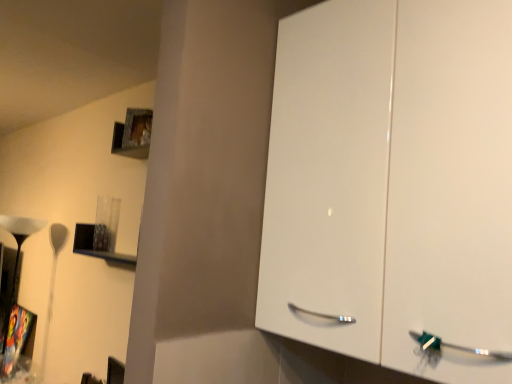
Question: Considering the positions of matte black lampshade at left and metallic silver shelf at upper left in the image, is matte black lampshade at left wider or thinner than metallic silver shelf at upper left?

Choices:
 (A) wide
 (B) thin

Answer: (A)

Question: In the image, is matte black lampshade at left positioned in front of or behind metallic silver shelf at upper left?

Choices:
 (A) front
 (B) behind

Answer: (B)

Question: Visually, is matte black lampshade at left positioned to the left or to the right of metallic silver shelf at upper left?

Choices:
 (A) left
 (B) right

Answer: (A)

Question: Is point (74, 238) positioned closer to the camera than point (9, 230)?

Choices:
 (A) closer
 (B) farther

Answer: (A)

Question: Would you say metallic silver shelf at upper left is inside or outside matte black lampshade at left?

Choices:
 (A) inside
 (B) outside

Answer: (B)

Question: Based on their sizes in the image, would you say metallic silver shelf at upper left is bigger or smaller than matte black lampshade at left?

Choices:
 (A) small
 (B) big

Answer: (A)

Question: Relative to matte black lampshade at left, is metallic silver shelf at upper left in front or behind?

Choices:
 (A) front
 (B) behind

Answer: (A)